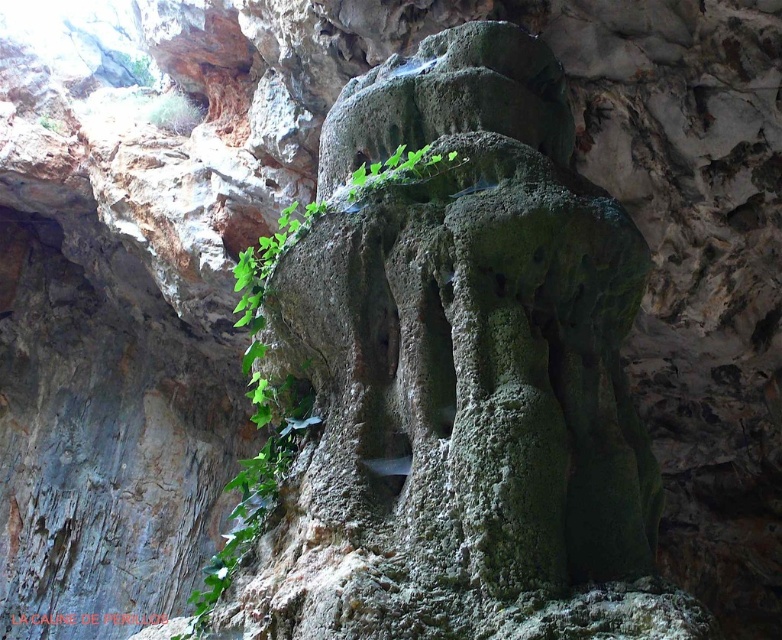
Question: Which point is farther from the camera taking this photo?

Choices:
 (A) (393, 164)
 (B) (580, 618)

Answer: (A)

Question: Can you confirm if green mossy rock at center is positioned below green leafy plant at center?

Choices:
 (A) no
 (B) yes

Answer: (A)

Question: Which point is closer to the camera?

Choices:
 (A) (386, 172)
 (B) (583, 604)

Answer: (B)

Question: Is green mossy rock at center behind green leafy plant at center?

Choices:
 (A) no
 (B) yes

Answer: (A)

Question: Is green mossy rock at center behind green leafy plant at center?

Choices:
 (A) no
 (B) yes

Answer: (A)